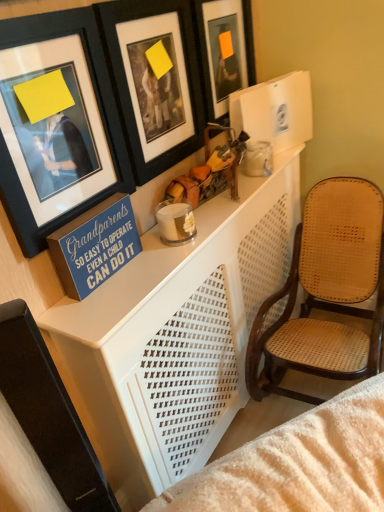
Question: Is orange matte picture frame at upper center, the 3th picture frame in the left-to-right sequence, not within blue painted wood sign at upper left?

Choices:
 (A) yes
 (B) no

Answer: (A)

Question: Is orange matte picture frame at upper center, acting as the 1th picture frame starting from the right, not close to blue painted wood sign at upper left?

Choices:
 (A) yes
 (B) no

Answer: (B)

Question: From a real-world perspective, is orange matte picture frame at upper center, the 3th picture frame in the left-to-right sequence, positioned under blue painted wood sign at upper left based on gravity?

Choices:
 (A) no
 (B) yes

Answer: (A)

Question: Does orange matte picture frame at upper center, acting as the 1th picture frame starting from the right, turn towards blue painted wood sign at upper left?

Choices:
 (A) no
 (B) yes

Answer: (A)

Question: Can you confirm if orange matte picture frame at upper center, acting as the 1th picture frame starting from the right, is wider than blue painted wood sign at upper left?

Choices:
 (A) no
 (B) yes

Answer: (A)

Question: Is orange matte picture frame at upper center, acting as the 1th picture frame starting from the right, bigger than blue painted wood sign at upper left?

Choices:
 (A) no
 (B) yes

Answer: (B)

Question: Does white perforated table at center appear on the right side of matte black picture frame at upper left, marked as the first picture frame in a left-to-right arrangement?

Choices:
 (A) no
 (B) yes

Answer: (B)

Question: Is white perforated table at center positioned with its back to matte black picture frame at upper left, acting as the third picture frame starting from the right?

Choices:
 (A) no
 (B) yes

Answer: (A)

Question: Does white perforated table at center appear on the left side of matte black picture frame at upper left, marked as the first picture frame in a left-to-right arrangement?

Choices:
 (A) no
 (B) yes

Answer: (A)

Question: From the image's perspective, is white perforated table at center below matte black picture frame at upper left, acting as the third picture frame starting from the right?

Choices:
 (A) yes
 (B) no

Answer: (A)

Question: Would you consider white perforated table at center to be distant from matte black picture frame at upper left, marked as the first picture frame in a left-to-right arrangement?

Choices:
 (A) yes
 (B) no

Answer: (B)

Question: Is the depth of white perforated table at center less than that of matte black picture frame at upper left, acting as the third picture frame starting from the right?

Choices:
 (A) no
 (B) yes

Answer: (A)

Question: Can you confirm if blue painted wood sign at upper left is smaller than black matte picture frame at upper center, the 2th picture frame when ordered from right to left?

Choices:
 (A) yes
 (B) no

Answer: (A)